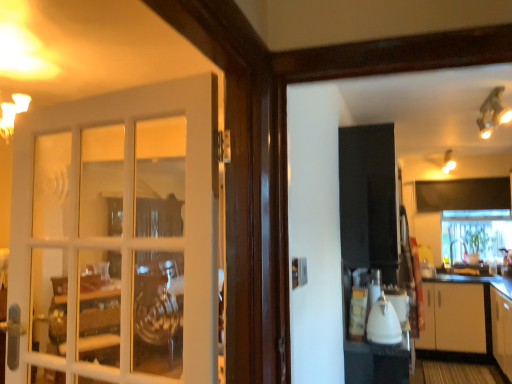
Question: Is white glossy countertop at right aimed at clear glass window at center?

Choices:
 (A) yes
 (B) no

Answer: (B)

Question: Is white glossy countertop at right surrounding clear glass window at center?

Choices:
 (A) no
 (B) yes

Answer: (A)

Question: Considering the relative sizes of white glossy countertop at right and clear glass window at center in the image provided, is white glossy countertop at right shorter than clear glass window at center?

Choices:
 (A) yes
 (B) no

Answer: (A)

Question: Does white glossy countertop at right have a lesser width compared to clear glass window at center?

Choices:
 (A) no
 (B) yes

Answer: (A)

Question: Considering the relative sizes of white glossy countertop at right and clear glass window at center in the image provided, is white glossy countertop at right taller than clear glass window at center?

Choices:
 (A) yes
 (B) no

Answer: (B)

Question: Is white glossy countertop at right to the left or to the right of white glossy cabinet at lower right in the image?

Choices:
 (A) left
 (B) right

Answer: (A)

Question: From a real-world perspective, is white glossy countertop at right positioned above or below white glossy cabinet at lower right?

Choices:
 (A) above
 (B) below

Answer: (A)

Question: From the image's perspective, is white glossy countertop at right located above or below white glossy cabinet at lower right?

Choices:
 (A) below
 (B) above

Answer: (B)

Question: Is white glossy countertop at right wider or thinner than white glossy cabinet at lower right?

Choices:
 (A) wide
 (B) thin

Answer: (A)

Question: From a real-world perspective, is white glossy cabinet at lower right above or below white glass door at left?

Choices:
 (A) above
 (B) below

Answer: (B)

Question: In terms of size, does white glossy cabinet at lower right appear bigger or smaller than white glass door at left?

Choices:
 (A) big
 (B) small

Answer: (A)

Question: In terms of height, does white glossy cabinet at lower right look taller or shorter compared to white glass door at left?

Choices:
 (A) tall
 (B) short

Answer: (B)

Question: Is white glossy cabinet at lower right spatially inside white glass door at left, or outside of it?

Choices:
 (A) outside
 (B) inside

Answer: (A)

Question: In the image, is clear glass window at center on the left side or the right side of white glossy countertop at right?

Choices:
 (A) right
 (B) left

Answer: (A)

Question: In terms of width, does clear glass window at center look wider or thinner when compared to white glossy countertop at right?

Choices:
 (A) wide
 (B) thin

Answer: (B)